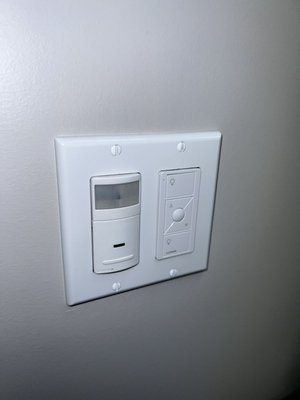
In order to click on space below outlet in this screenshot , I will do `click(161, 302)`.